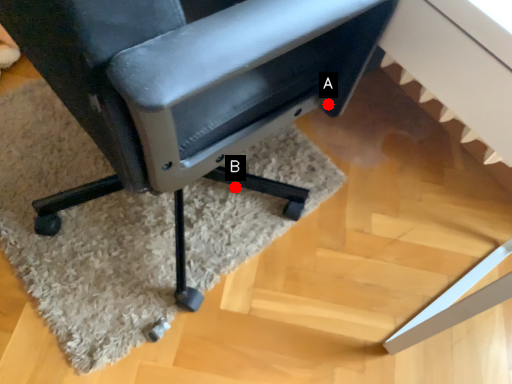
Question: Two points are circled on the image, labeled by A and B beside each circle. Which of the following is the farthest from the observer?

Choices:
 (A) A is further
 (B) B is further

Answer: (B)